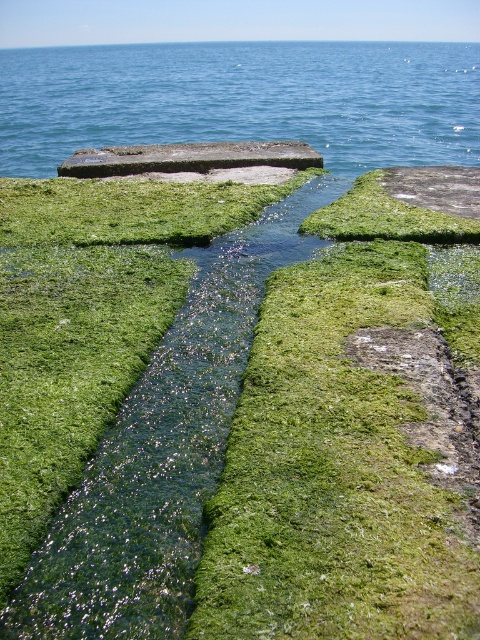
Question: Which of the following is the closest to the observer?

Choices:
 (A) coord(144,49)
 (B) coord(80,314)

Answer: (B)

Question: Which point is closer to the camera?

Choices:
 (A) smooth concrete slab at center
 (B) blue water at upper center

Answer: (A)

Question: Does blue water at upper center appear on the left side of green mossy grass at center?

Choices:
 (A) no
 (B) yes

Answer: (A)

Question: Which point appears closest to the camera in this image?

Choices:
 (A) (32, 428)
 (B) (178, 145)

Answer: (A)

Question: Is blue water at upper center positioned before green mossy grass at center?

Choices:
 (A) no
 (B) yes

Answer: (A)

Question: Can you confirm if green mossy grass at center is smaller than smooth concrete slab at center?

Choices:
 (A) no
 (B) yes

Answer: (B)